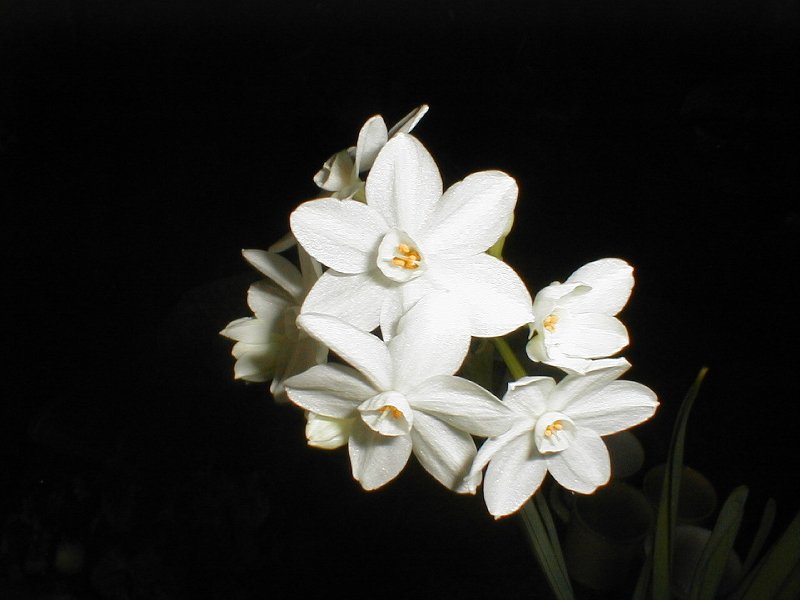
At what (x,y) coordinates should I click in order to perform the action: click on long green plant. Please return your answer as a coordinate pair (x, y). Looking at the image, I should click on (654, 538).